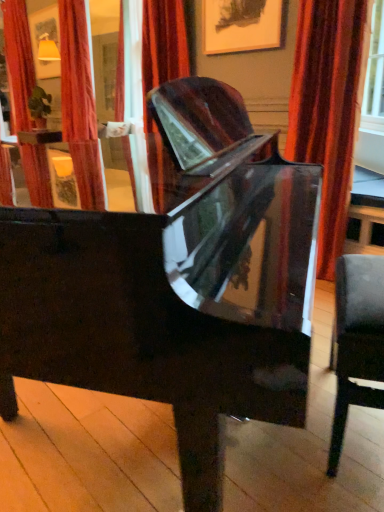
Question: Is velvet-like red curtain at right, the second curtain viewed from the back, at the right side of glossy black piano at center?

Choices:
 (A) no
 (B) yes

Answer: (B)

Question: Considering the relative sizes of velvet-like red curtain at right, acting as the 1th curtain starting from the front, and glossy black piano at center in the image provided, is velvet-like red curtain at right, acting as the 1th curtain starting from the front, smaller than glossy black piano at center?

Choices:
 (A) yes
 (B) no

Answer: (A)

Question: From the image's perspective, is velvet-like red curtain at right, the second curtain viewed from the back, above glossy black piano at center?

Choices:
 (A) yes
 (B) no

Answer: (A)

Question: From the image's perspective, is velvet-like red curtain at right, which is counted as the second curtain, starting from the left, located beneath glossy black piano at center?

Choices:
 (A) yes
 (B) no

Answer: (B)

Question: Can you confirm if velvet-like red curtain at right, marked as the first curtain in a right-to-left arrangement, is thinner than glossy black piano at center?

Choices:
 (A) yes
 (B) no

Answer: (A)

Question: Would you say leather-like black chair at right is to the left or to the right of velvet-like red curtain at right, which is the second curtain from top to bottom, in the picture?

Choices:
 (A) left
 (B) right

Answer: (A)

Question: From a real-world perspective, is leather-like black chair at right positioned above or below velvet-like red curtain at right, the second curtain viewed from the back?

Choices:
 (A) below
 (B) above

Answer: (A)

Question: Choose the correct answer: Is leather-like black chair at right inside velvet-like red curtain at right, which is the second curtain from top to bottom, or outside it?

Choices:
 (A) inside
 (B) outside

Answer: (B)

Question: In the image, is leather-like black chair at right positioned in front of or behind velvet-like red curtain at right, which is the second curtain from top to bottom?

Choices:
 (A) front
 (B) behind

Answer: (A)

Question: Considering the positions of velvet-like red curtain at right, which is the second curtain from top to bottom, and velvet red curtain at upper left, marked as the second curtain in a bottom-to-top arrangement, in the image, is velvet-like red curtain at right, which is the second curtain from top to bottom, taller or shorter than velvet red curtain at upper left, marked as the second curtain in a bottom-to-top arrangement,?

Choices:
 (A) tall
 (B) short

Answer: (B)

Question: From a real-world perspective, relative to velvet red curtain at upper left, marked as the second curtain in a bottom-to-top arrangement, is velvet-like red curtain at right, marked as the first curtain in a right-to-left arrangement, vertically above or below?

Choices:
 (A) below
 (B) above

Answer: (A)

Question: In the image, is velvet-like red curtain at right, marked as the first curtain in a right-to-left arrangement, on the left side or the right side of velvet red curtain at upper left, marked as the second curtain in a bottom-to-top arrangement?

Choices:
 (A) left
 (B) right

Answer: (B)

Question: Looking at their shapes, would you say velvet-like red curtain at right, which is the second curtain from top to bottom, is wider or thinner than velvet red curtain at upper left, which is the 2th curtain from front to back?

Choices:
 (A) wide
 (B) thin

Answer: (B)

Question: In terms of width, does leather-like black chair at right look wider or thinner when compared to velvet red curtain at upper left, positioned as the 2th curtain in right-to-left order?

Choices:
 (A) wide
 (B) thin

Answer: (B)

Question: In terms of height, does leather-like black chair at right look taller or shorter compared to velvet red curtain at upper left, marked as the second curtain in a bottom-to-top arrangement?

Choices:
 (A) short
 (B) tall

Answer: (A)